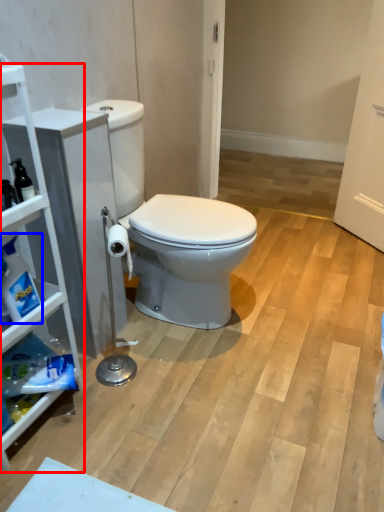
Question: Among these objects, which one is farthest to the camera, cabinetry (highlighted by a red box) or cleaning product (highlighted by a blue box)?

Choices:
 (A) cabinetry
 (B) cleaning product

Answer: (B)